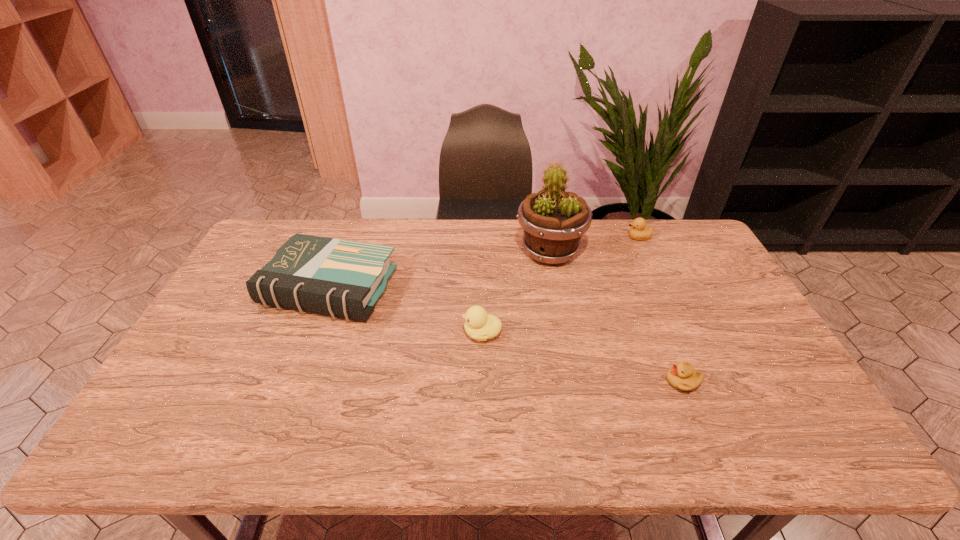
Identify the location of the third object from left to right. The image size is (960, 540). (553, 221).

You are a GUI agent. You are given a task and a screenshot of the screen. Output one action in this format:
    pyautogui.click(x=<x>, y=<y>)
    Task: Click on the tallest object
    
    Given the screenshot: What is the action you would take?
    pyautogui.click(x=553, y=221)

You are a GUI agent. You are given a task and a screenshot of the screen. Output one action in this format:
    pyautogui.click(x=<x>, y=<y>)
    Task: Click on the leftmost object
    The width and height of the screenshot is (960, 540).
    Given the screenshot: What is the action you would take?
    pyautogui.click(x=340, y=278)

Where is `the tallest duckling`? the tallest duckling is located at coordinates (479, 325).

Image resolution: width=960 pixels, height=540 pixels. Find the location of `the leftmost duckling`. the leftmost duckling is located at coordinates (479, 325).

Find the location of a particular element. The width and height of the screenshot is (960, 540). the fourth tallest object is located at coordinates (638, 231).

This screenshot has height=540, width=960. Find the location of `the farthest duckling`. the farthest duckling is located at coordinates (638, 231).

Identify the location of the shortest object. (682, 376).

The height and width of the screenshot is (540, 960). Identify the location of the shortest duckling. (682, 376).

At what (x,y) coordinates should I click in order to perform the action: click on free space located 0.330m on the right of the flowerpot. Please return your answer as a coordinate pair (x, y). The width and height of the screenshot is (960, 540). Looking at the image, I should click on (683, 252).